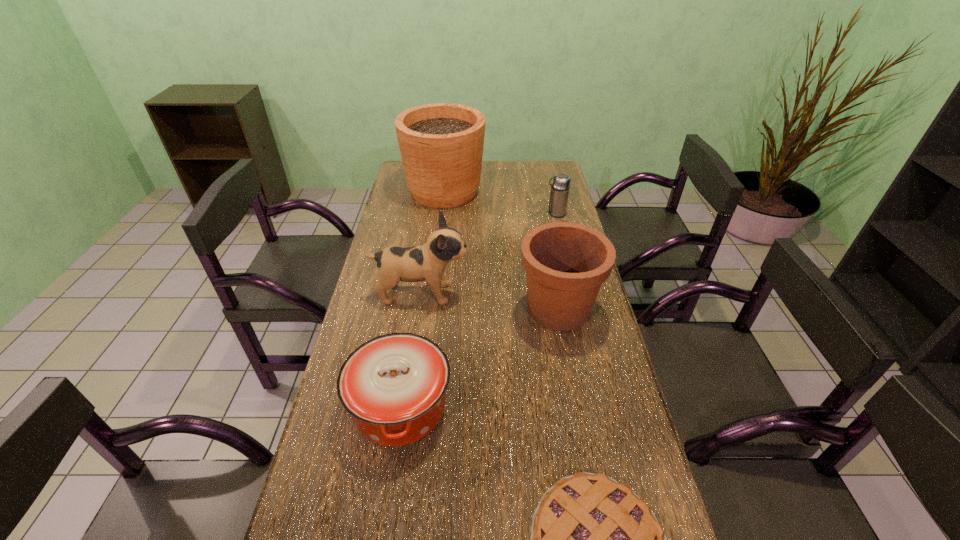
Where is `vacant point located with a handle on the side of the thermos bottle`? vacant point located with a handle on the side of the thermos bottle is located at coordinates click(x=468, y=214).

You are a GUI agent. You are given a task and a screenshot of the screen. Output one action in this format:
    pyautogui.click(x=<x>, y=<y>)
    Task: Click on the vacant position located 0.350m with a handle on the side of the thermos bottle
    Image resolution: width=960 pixels, height=540 pixels.
    Given the screenshot: What is the action you would take?
    pyautogui.click(x=457, y=214)

I want to click on vacant space located with a handle on the side of the thermos bottle, so click(500, 214).

In order to click on vacant space located on the back of the fifth farthest object in this screenshot , I will do `click(418, 295)`.

Locate an element on the screen. Image resolution: width=960 pixels, height=540 pixels. object present at the far edge is located at coordinates (441, 144).

You are a GUI agent. You are given a task and a screenshot of the screen. Output one action in this format:
    pyautogui.click(x=<x>, y=<y>)
    Task: Click on the flowerpot present at the left edge
    This screenshot has width=960, height=540.
    Given the screenshot: What is the action you would take?
    pyautogui.click(x=441, y=144)

In order to click on puppy that is positioned at the left edge in this screenshot , I will do `click(427, 263)`.

Identify the location of casserole situated at the left edge. (394, 385).

Where is `flowerpot positioned at the right edge`? flowerpot positioned at the right edge is located at coordinates (566, 263).

Where is `thermos bottle that is at the right edge`? thermos bottle that is at the right edge is located at coordinates (561, 184).